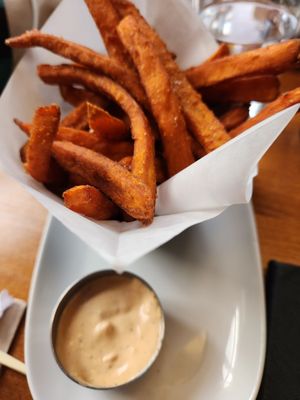
The height and width of the screenshot is (400, 300). Identify the location of plate. (202, 282).